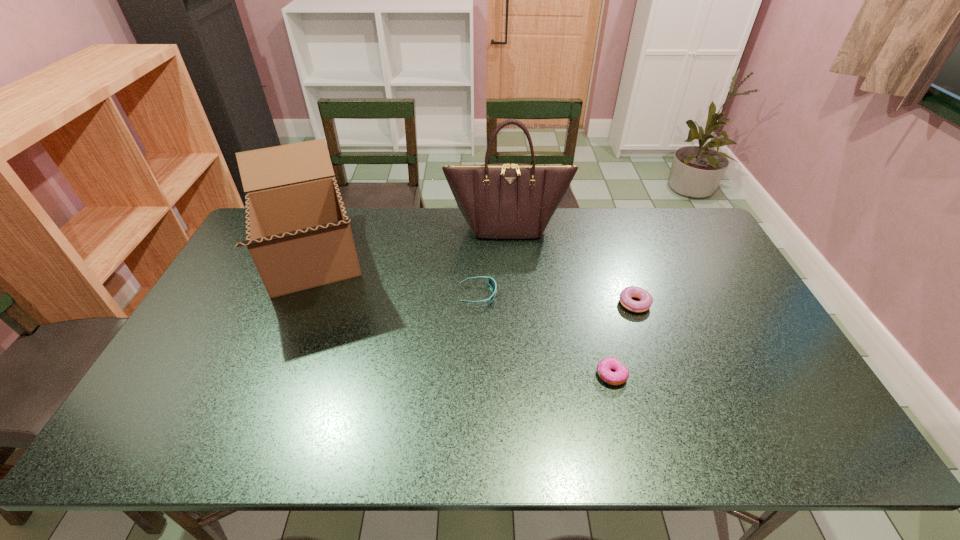
Identify the location of vacant area that lies between the tallest object and the leftmost object. (410, 243).

At what (x,y) coordinates should I click in order to perform the action: click on blank region between the handbag and the leftmost object. Please return your answer as a coordinate pair (x, y). Image resolution: width=960 pixels, height=540 pixels. Looking at the image, I should click on (410, 243).

The height and width of the screenshot is (540, 960). I want to click on vacant area that lies between the box and the tallest object, so click(x=410, y=243).

Identify which object is located as the second nearest to the rightmost object. Please provide its 2D coordinates. Your answer should be formatted as a tuple, i.e. [(x, y)], where the tuple contains the x and y coordinates of a point satisfying the conditions above.

[(505, 200)]

The height and width of the screenshot is (540, 960). Find the location of `object that is the second closest to the fourth shortest object`. object that is the second closest to the fourth shortest object is located at coordinates (491, 281).

I want to click on vacant point that satisfies the following two spatial constraints: 1. on the front-facing side of the handbag; 2. on the front-facing side of the sunglasses, so click(x=512, y=295).

At what (x,y) coordinates should I click in order to perform the action: click on vacant space that satisfies the following two spatial constraints: 1. on the front-facing side of the sunglasses; 2. on the back side of the nearer doughnut. Please return your answer as a coordinate pair (x, y). Looking at the image, I should click on (478, 375).

Locate an element on the screen. Image resolution: width=960 pixels, height=540 pixels. free space that satisfies the following two spatial constraints: 1. on the front-facing side of the farther doughnut; 2. on the left side of the sunglasses is located at coordinates (x=478, y=305).

Find the location of a particular element. Image resolution: width=960 pixels, height=540 pixels. vacant region that satisfies the following two spatial constraints: 1. on the front-facing side of the tallest object; 2. on the right side of the farther doughnut is located at coordinates (513, 305).

Where is `free space that satisfies the following two spatial constraints: 1. on the front-facing side of the handbag; 2. on the left side of the farther doughnut`? The image size is (960, 540). free space that satisfies the following two spatial constraints: 1. on the front-facing side of the handbag; 2. on the left side of the farther doughnut is located at coordinates (513, 305).